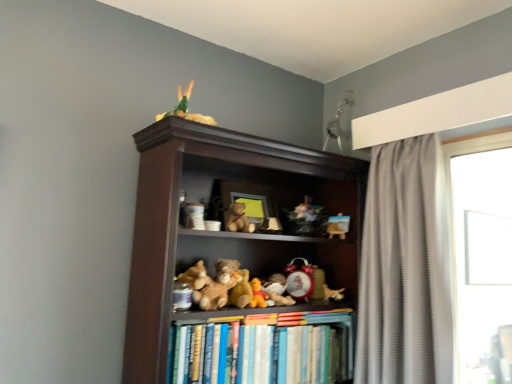
Question: Is gray textured curtain at right spatially inside brown wooden bookcase at center, or outside of it?

Choices:
 (A) inside
 (B) outside

Answer: (B)

Question: From the image's perspective, is gray textured curtain at right positioned above or below brown wooden bookcase at center?

Choices:
 (A) below
 (B) above

Answer: (B)

Question: Considering the real-world distances, which object is closest to the soft plush bear at center, the 9th toy from the right?

Choices:
 (A) soft plush bear at center, which is the 5th toy in right-to-left order
 (B) fluffy brown teddy bear at center, positioned as the 3th toy in left-to-right order
 (C) shiny red alarm clock at center, the 4th toy positioned from the right
 (D) wooden floral arrangement at center, placed as the 8th toy when sorted from left to right
 (E) matte white figurine at center, the sixth toy viewed from the right

Answer: (B)

Question: Which is nearer to the transparent glass window at right?

Choices:
 (A) wooden floral arrangement at center, which is the third toy from right to left
 (B) soft plush bear at center, which is the 5th toy in right-to-left order
 (C) gray textured curtain at right
 (D) wooden easel at upper center, which appears as the tenth toy when viewed from the left
 (E) hardcover books at center

Answer: (C)